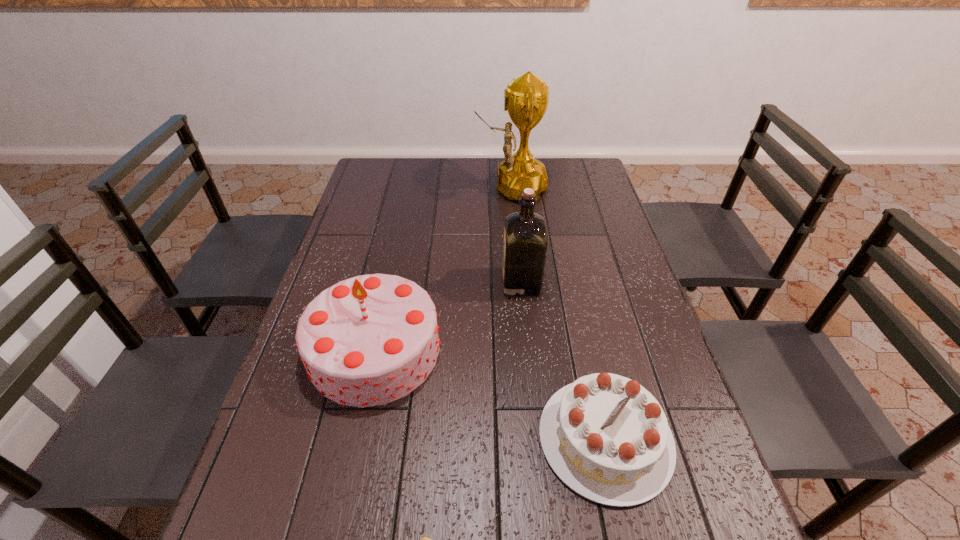
The height and width of the screenshot is (540, 960). In order to click on the tallest object in this screenshot , I will do click(x=526, y=98).

Identify the location of award. (526, 98).

Image resolution: width=960 pixels, height=540 pixels. In order to click on liquor in this screenshot , I will do `click(525, 232)`.

Identify the location of the second tallest object. (525, 232).

Where is `the left birthday cake`? This screenshot has height=540, width=960. the left birthday cake is located at coordinates (369, 340).

Where is `the taller birthday cake`? the taller birthday cake is located at coordinates (369, 340).

You are a GUI agent. You are given a task and a screenshot of the screen. Output one action in this format:
    pyautogui.click(x=<x>, y=<y>)
    Task: Click on the shorter birthday cake
    The image size is (960, 540).
    Given the screenshot: What is the action you would take?
    pyautogui.click(x=605, y=436)

Find the location of a particular element. Image resolution: width=960 pixels, height=540 pixels. the second shortest object is located at coordinates (605, 436).

The height and width of the screenshot is (540, 960). Identify the location of vacant space located on the front side of the farthest object. (368, 188).

Identify the location of free region located on the front side of the farthest object. This screenshot has width=960, height=540. (442, 188).